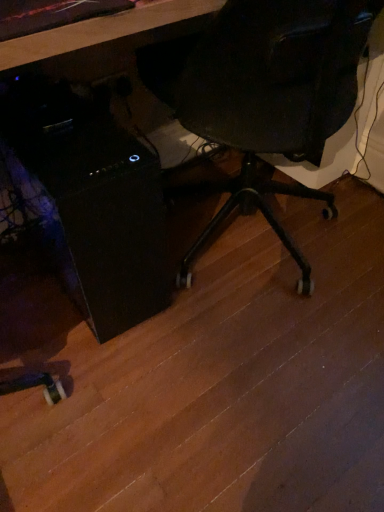
Locate an element on the screen. Image resolution: width=384 pixels, height=512 pixels. free space to the left of black matte computer tower at lower left is located at coordinates (24, 283).